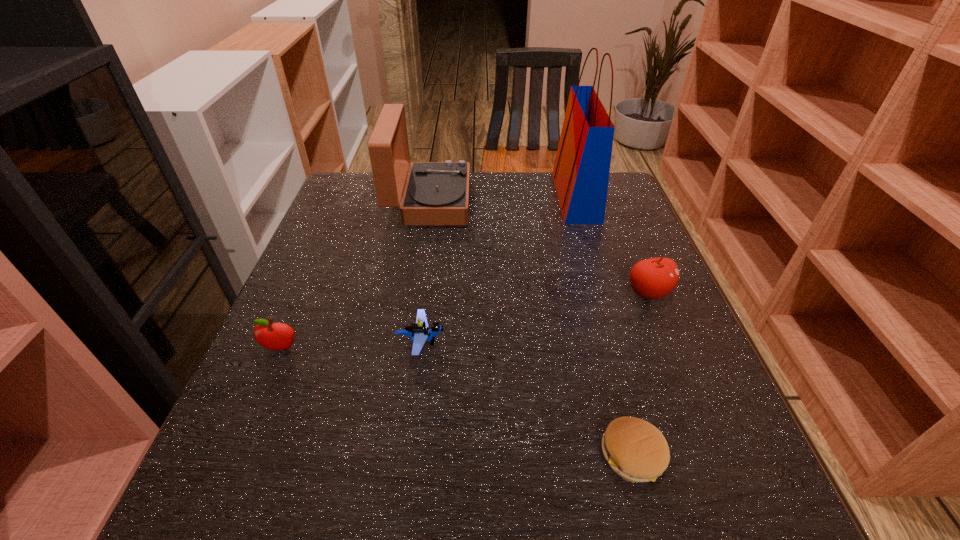
Where is `shopping bag`? This screenshot has width=960, height=540. shopping bag is located at coordinates (581, 171).

Identify the location of phonograph record. The height and width of the screenshot is (540, 960). (436, 193).

You are a GUI agent. You are given a task and a screenshot of the screen. Output one action in this format:
    pyautogui.click(x=<x>, y=<y>)
    Task: Click on the third farthest object
    The height and width of the screenshot is (540, 960).
    Given the screenshot: What is the action you would take?
    pyautogui.click(x=654, y=278)

Locate an element on the screen. This screenshot has width=960, height=540. the farther apple is located at coordinates (654, 278).

Image resolution: width=960 pixels, height=540 pixels. What are the coordinates of `the third shortest object` in the screenshot? It's located at (274, 336).

This screenshot has height=540, width=960. Find the location of `the left apple`. the left apple is located at coordinates (274, 336).

This screenshot has height=540, width=960. Find the location of `Lego`. Lego is located at coordinates (419, 332).

This screenshot has height=540, width=960. What are the coordinates of `the nearest object` in the screenshot? It's located at (636, 450).

You are a GUI agent. You are given a task and a screenshot of the screen. Output one action in this format:
    pyautogui.click(x=<x>, y=<y>)
    Task: Click on the shortest object
    
    Given the screenshot: What is the action you would take?
    pyautogui.click(x=636, y=450)

Where is `vacant space located 0.090m on the handle side of the shopping bag`? This screenshot has width=960, height=540. vacant space located 0.090m on the handle side of the shopping bag is located at coordinates (524, 197).